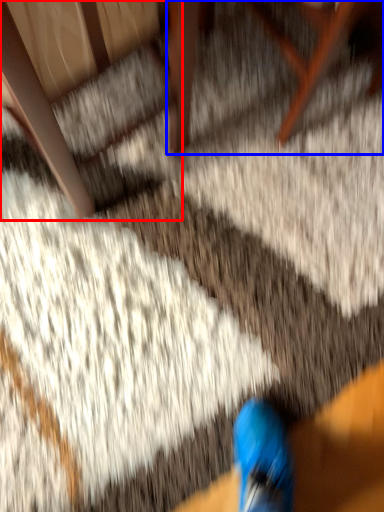
Question: Which object appears farthest to the camera in this image, armchair (highlighted by a red box) or furniture (highlighted by a blue box)?

Choices:
 (A) armchair
 (B) furniture

Answer: (B)